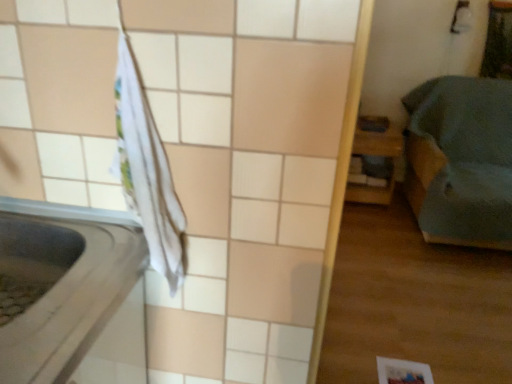
This screenshot has height=384, width=512. What are the coordinates of `vacant space situated above white matte paper at lower right (from a real-world perspective)` in the screenshot? It's located at (397, 371).